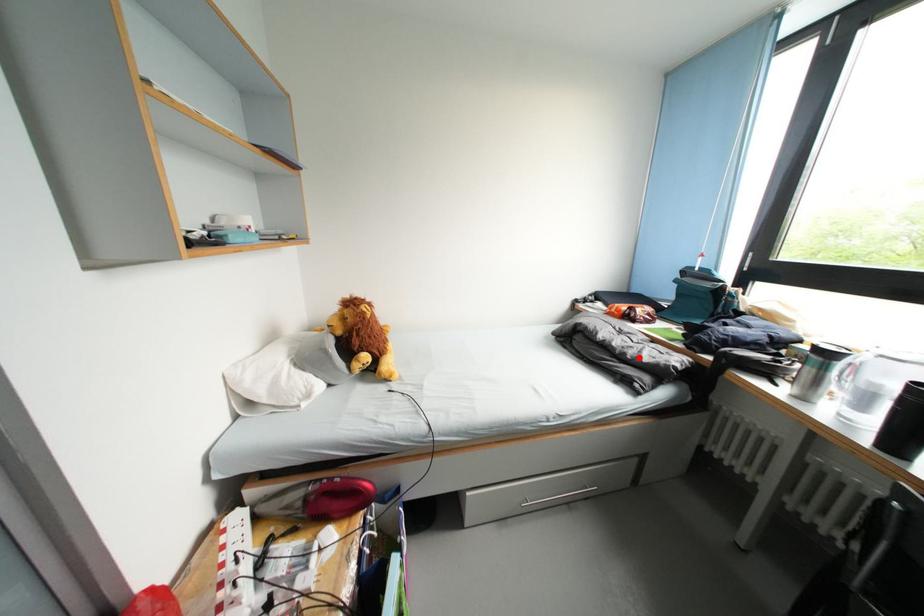
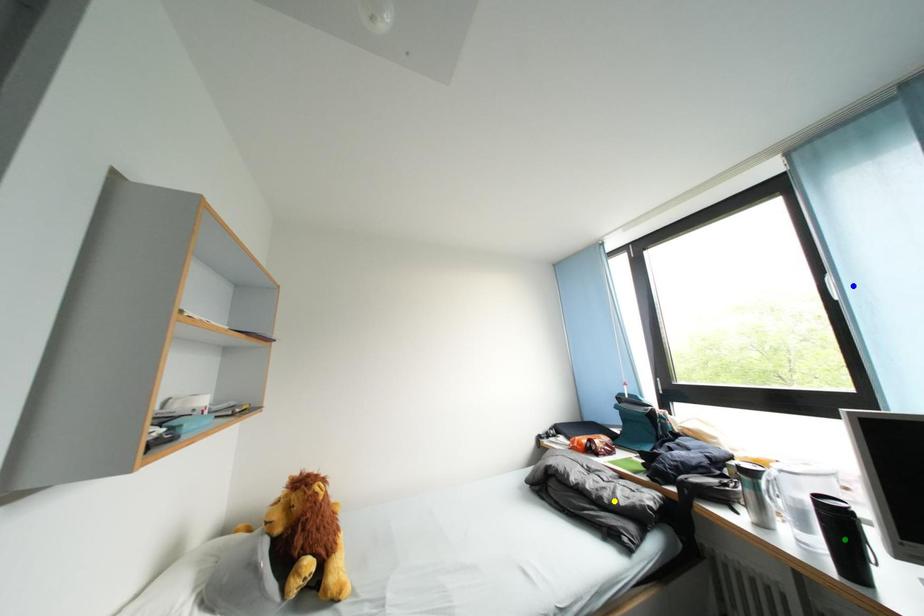
Question: I am providing you with two images of the same scene from different viewpoints. A red point is marked on the first image. You are given multiple points on the second image. Which spot in image 2 lines up with the point in image 1?

Choices:
 (A) green point
 (B) yellow point
 (C) blue point

Answer: (B)